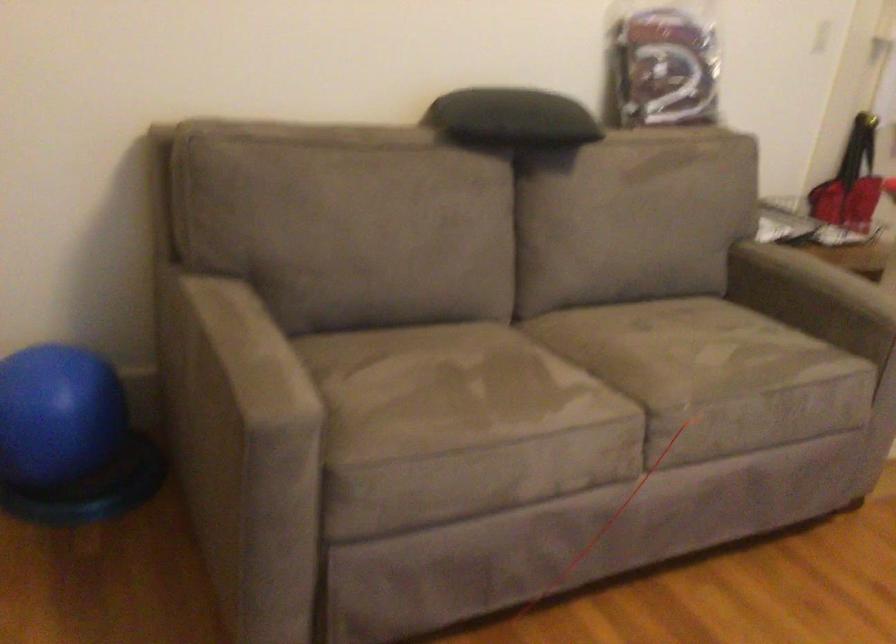
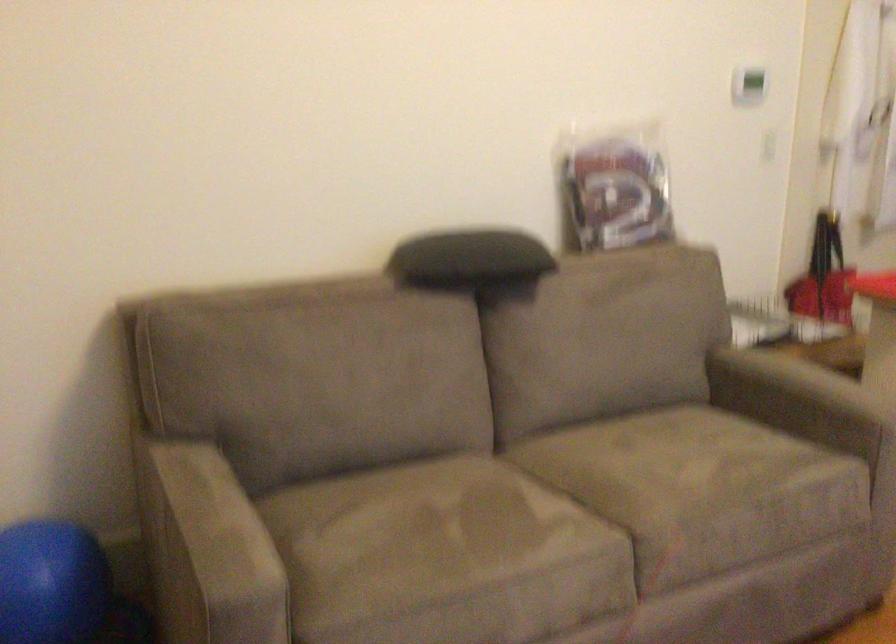
In the second image, find the point that corresponds to the point at 721,355 in the first image.

(702, 471)